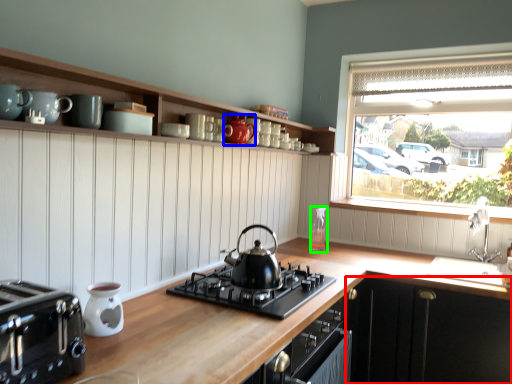
Question: Estimate the real-world distances between objects in this image. Which object is closer to cabinetry (highlighted by a red box), tea pot (highlighted by a blue box) or bottle (highlighted by a green box)?

Choices:
 (A) tea pot
 (B) bottle

Answer: (B)